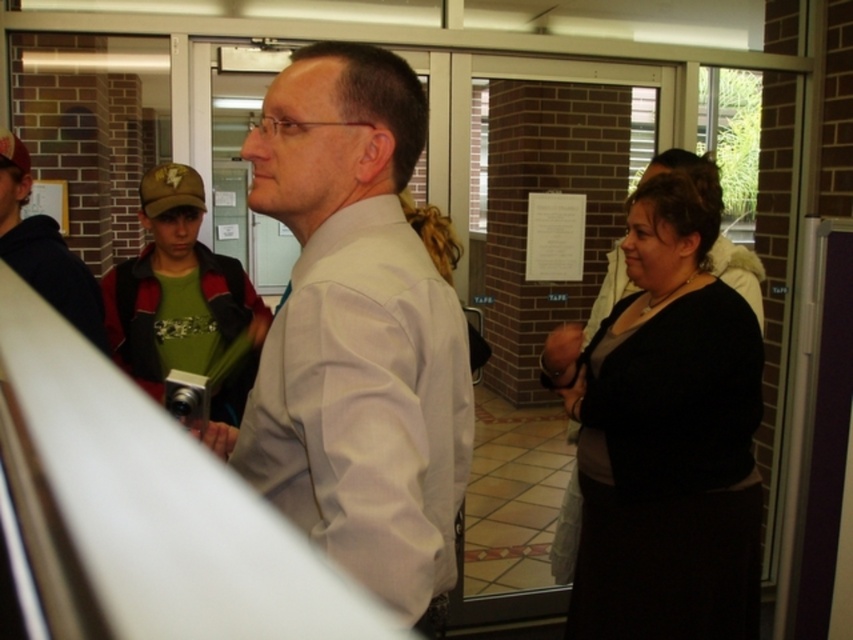
You are a photographer setting up a photo shoot in the described scene. You need to ensure that both the white smooth shirt at center and the black matte dress at right are visible in the frame. Given their height difference, which clothing item will you need to position closer to the camera to maintain balance in the composition?

The white smooth shirt at center is shorter than the black matte dress at right. To balance the composition, position the white smooth shirt at center closer to the camera so its apparent size matches the black matte dress at right.

You are organizing a charity event and need to decide which clothing item to display first. The black matte dress at right and the matte white shirt at center are both available. Based on their sizes, which one should you choose if you want to display the thinner item first?

The black matte dress at right is thinner than the matte white shirt at center, so you should display the black matte dress at right first.